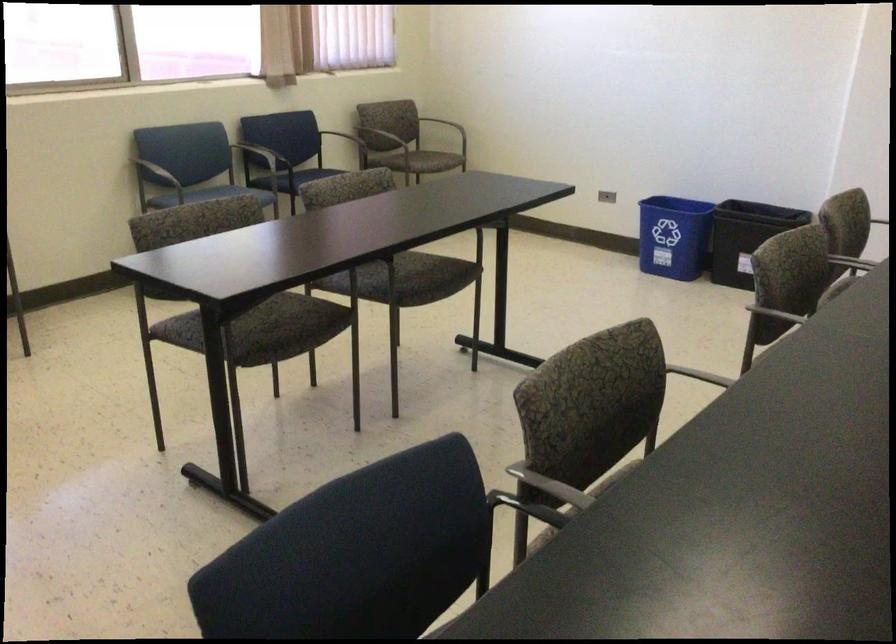
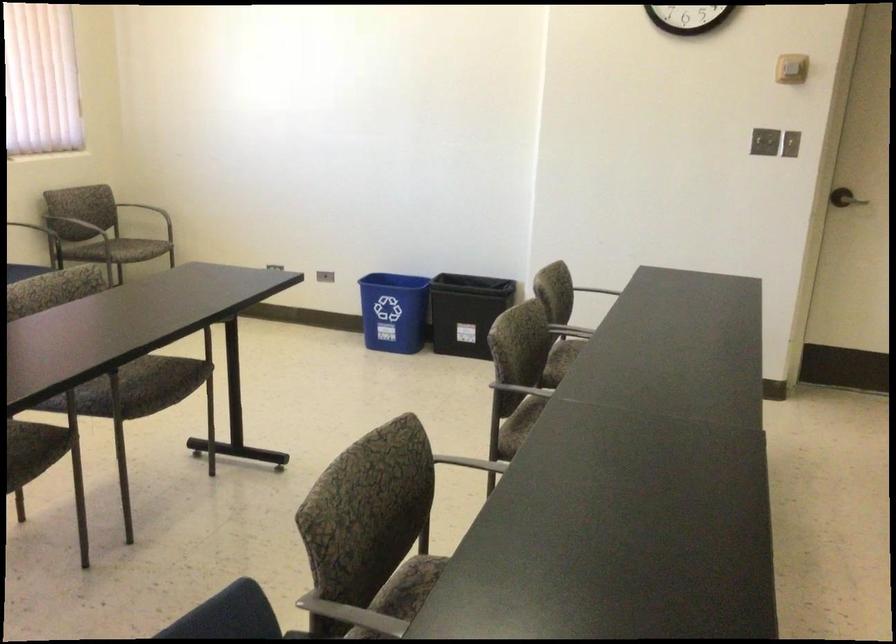
The images are taken continuously from a first-person perspective. In which direction is your viewpoint rotating?

The camera's rotation is toward right-down.